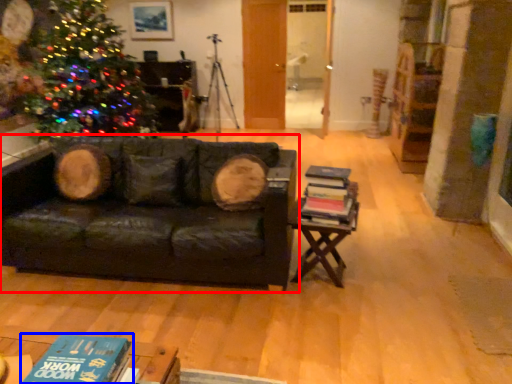
Question: Which object appears closest to the camera in this image, studio couch (highlighted by a red box) or book (highlighted by a blue box)?

Choices:
 (A) studio couch
 (B) book

Answer: (B)